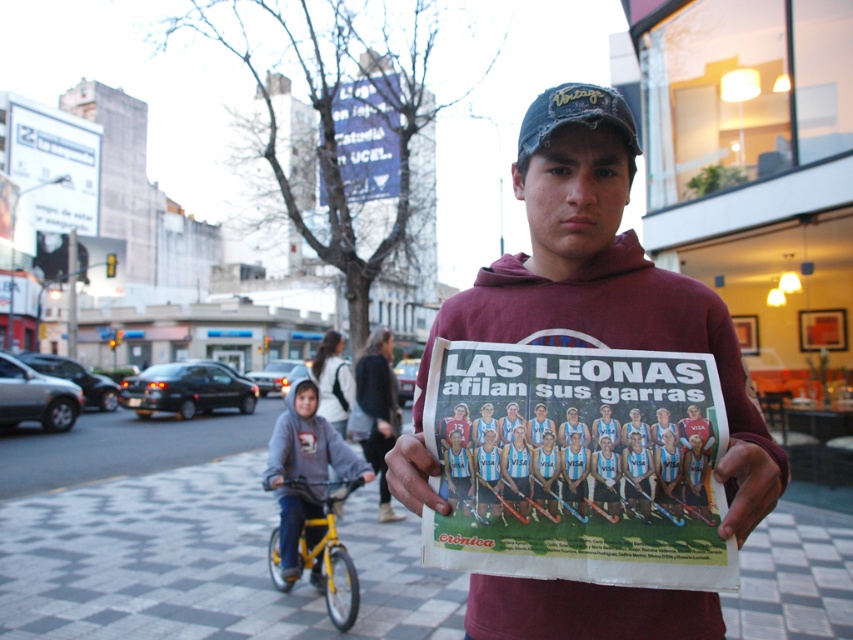
Is maroon hoodie at center thinner than distressed denim baseball cap at center?

Indeed, maroon hoodie at center has a lesser width compared to distressed denim baseball cap at center.

Does maroon hoodie at center have a greater width compared to distressed denim baseball cap at center?

In fact, maroon hoodie at center might be narrower than distressed denim baseball cap at center.

Find the location of `maroon hoodie at center`. maroon hoodie at center is located at coordinates (595, 276).

Who is lower down, gray hoodie at lower left or smooth paper hand at center?

Positioned lower is gray hoodie at lower left.

Can you confirm if gray hoodie at lower left is positioned below smooth paper hand at center?

Yes.

Locate an element on the screen. gray hoodie at lower left is located at coordinates (305, 467).

I want to click on gray hoodie at lower left, so click(305, 467).

Can you confirm if smooth skin hand at center is positioned to the left of smooth paper hand at center?

In fact, smooth skin hand at center is to the right of smooth paper hand at center.

Who is positioned more to the left, smooth skin hand at center or smooth paper hand at center?

From the viewer's perspective, smooth paper hand at center appears more on the left side.

Image resolution: width=853 pixels, height=640 pixels. What do you see at coordinates (747, 486) in the screenshot?
I see `smooth skin hand at center` at bounding box center [747, 486].

At what (x,y) coordinates should I click in order to perform the action: click on smooth skin hand at center. Please return your answer as a coordinate pair (x, y). Looking at the image, I should click on (747, 486).